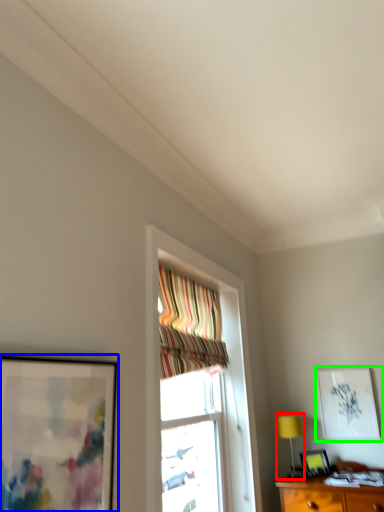
Question: Which object is positioned farthest from table lamp (highlighted by a red box)? Select from picture frame (highlighted by a blue box) and picture frame (highlighted by a green box).

Choices:
 (A) picture frame
 (B) picture frame

Answer: (A)